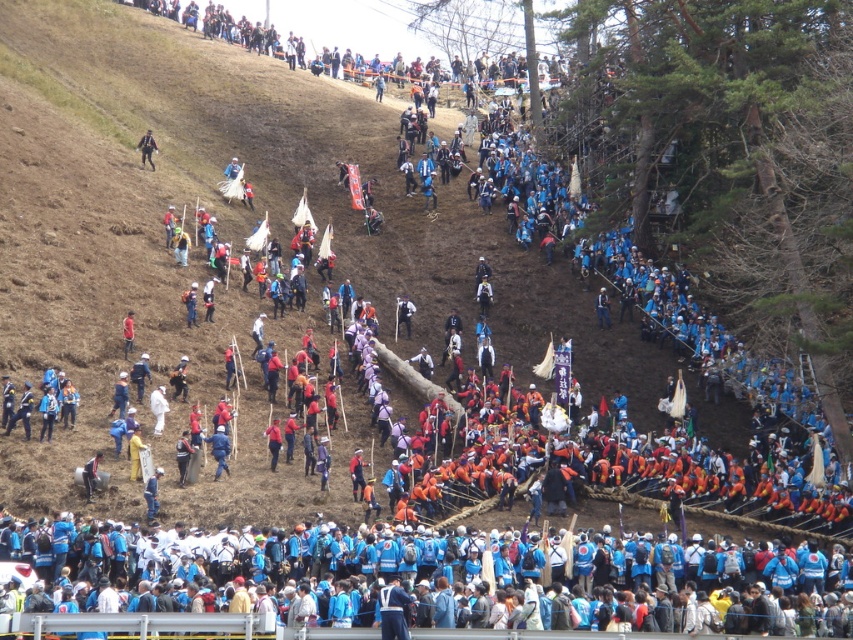
You are organizing a safety briefing for attendees at this event. You need to ensure that the blue fabric jacket at center and the matte black backpack at upper left are visible from the stage. Given their sizes, which object might be easier to spot from a distance?

The blue fabric jacket at center is wider than the matte black backpack at upper left, so it might be easier to spot from a distance due to its greater width.

You are standing at the camera position and want to throw a frisbee to someone wearing the blue fabric jacket at center. Is the distance too far for a typical frisbee throw?

The distance between you and the blue fabric jacket at center is 289.56 feet, which is far beyond the typical frisbee throw range of around 150 feet. It would be too far to reach with a standard throw.

You are a participant at the event and need to find the blue fabric jacket at center. Based on the coordinates provided, where would you look relative to the metal railing?

The blue fabric jacket at center is located at coordinates point (219, 449), which places it above the metal railing since the y coordinate 0.258 is closer to the top of the image compared to the bottom where the railing is situated.